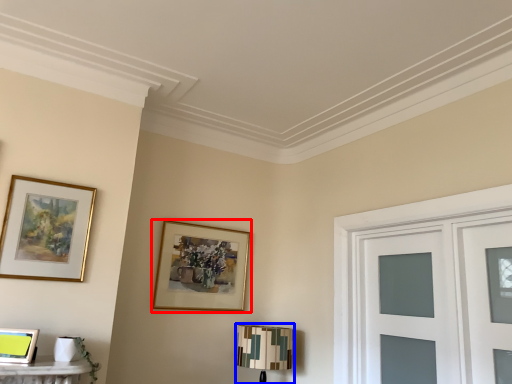
Question: Which object appears farthest to the camera in this image, picture frame (highlighted by a red box) or table lamp (highlighted by a blue box)?

Choices:
 (A) picture frame
 (B) table lamp

Answer: (A)